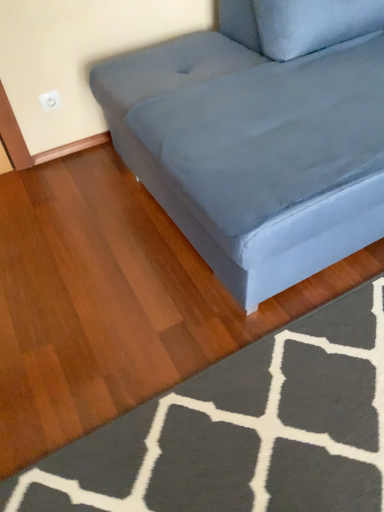
Question: Is suede-like gray couch at center taller or shorter than dark gray textured rug at lower right?

Choices:
 (A) tall
 (B) short

Answer: (A)

Question: In the image, is suede-like gray couch at center on the left side or the right side of dark gray textured rug at lower right?

Choices:
 (A) right
 (B) left

Answer: (A)

Question: Is point (271, 46) positioned closer to the camera than point (367, 385)?

Choices:
 (A) farther
 (B) closer

Answer: (A)

Question: Considering the positions of dark gray textured rug at lower right and suede-like gray couch at center in the image, is dark gray textured rug at lower right taller or shorter than suede-like gray couch at center?

Choices:
 (A) tall
 (B) short

Answer: (B)

Question: From a real-world perspective, is dark gray textured rug at lower right positioned above or below suede-like gray couch at center?

Choices:
 (A) below
 (B) above

Answer: (A)

Question: Considering the positions of dark gray textured rug at lower right and suede-like gray couch at center in the image, is dark gray textured rug at lower right bigger or smaller than suede-like gray couch at center?

Choices:
 (A) big
 (B) small

Answer: (B)

Question: Which is correct: dark gray textured rug at lower right is inside suede-like gray couch at center, or outside of it?

Choices:
 (A) inside
 (B) outside

Answer: (B)